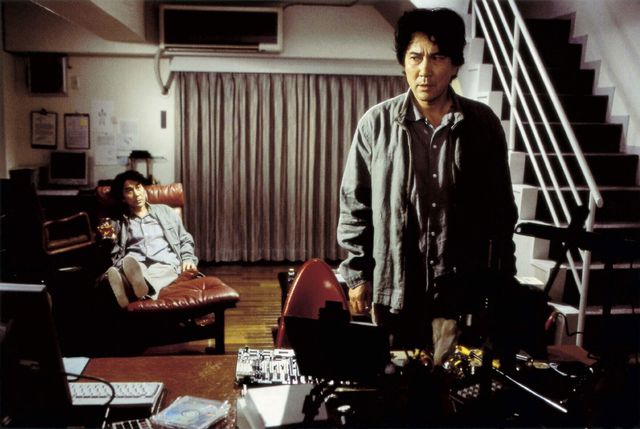
Where is `piano`? The width and height of the screenshot is (640, 429). piano is located at coordinates (68, 235).